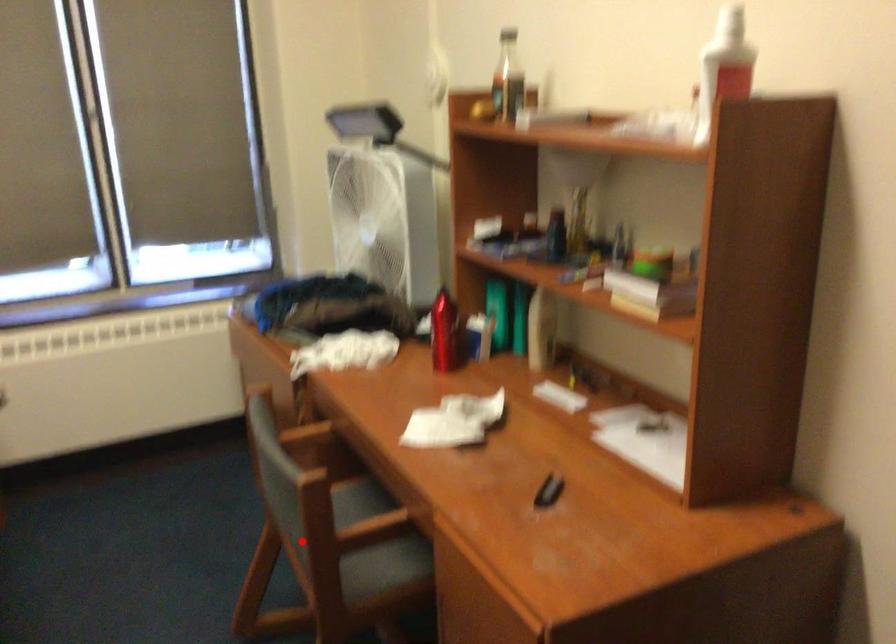
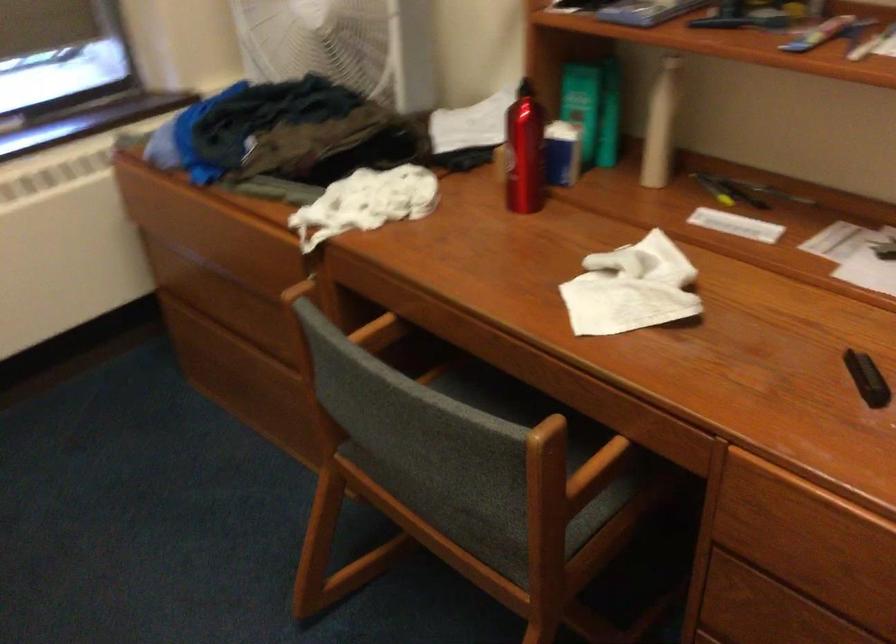
In the second image, find the point that corresponds to the highlighted location in the first image.

(488, 509)